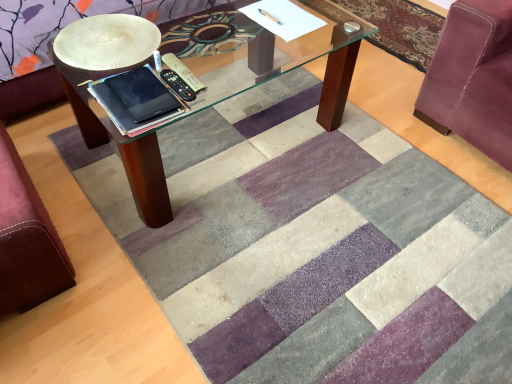
The height and width of the screenshot is (384, 512). I want to click on free area in between velvet burgundy swivel chair at lower left, which is counted as the second swivel chair, starting from the right, and velvet maroon swivel chair at right, placed as the 2th swivel chair when sorted from left to right, so click(270, 172).